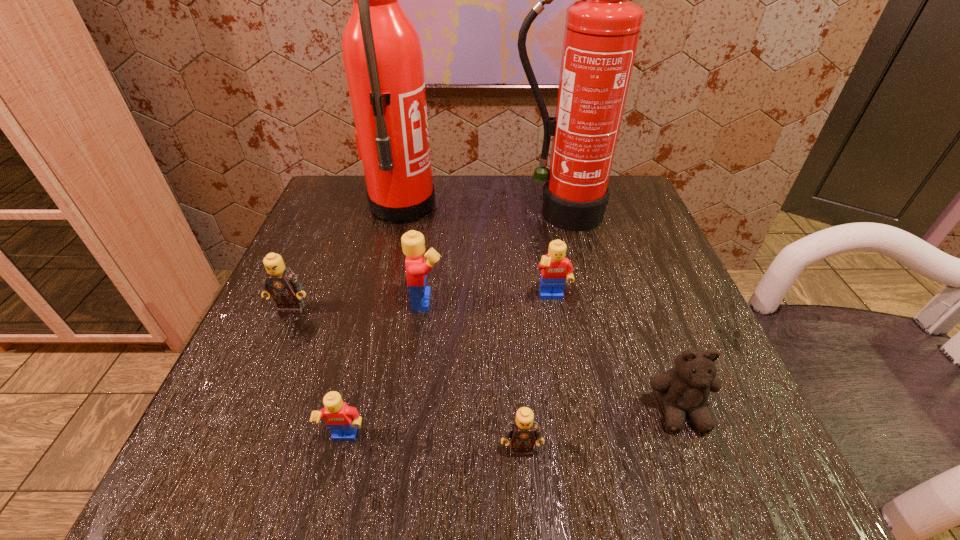
Locate an element on the screen. This screenshot has height=540, width=960. the left fire extinguisher is located at coordinates (381, 50).

Find the location of `the right fire extinguisher`. the right fire extinguisher is located at coordinates (602, 30).

This screenshot has height=540, width=960. In order to click on the third Lego from left to right in this screenshot , I will do `click(413, 243)`.

Where is `the biggest yellow Lego`? This screenshot has height=540, width=960. the biggest yellow Lego is located at coordinates (413, 243).

What are the coordinates of `the rightmost yellow Lego` in the screenshot? It's located at (555, 269).

Find the location of `the rightmost Lego`. the rightmost Lego is located at coordinates (555, 269).

At what (x,y) coordinates should I click in order to perform the action: click on the left tan Lego. Please return your answer as a coordinate pair (x, y). Looking at the image, I should click on (281, 283).

Image resolution: width=960 pixels, height=540 pixels. Identify the location of the farther tan Lego. (281, 283).

Where is `teddy bear`? This screenshot has width=960, height=540. teddy bear is located at coordinates (684, 390).

Where is `the leftmost yellow Lego`? This screenshot has height=540, width=960. the leftmost yellow Lego is located at coordinates (342, 420).